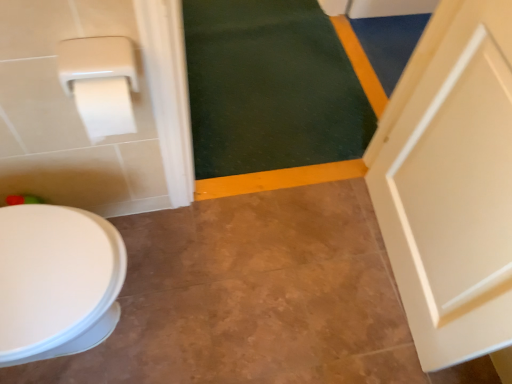
I want to click on white matte toilet paper at upper left, so click(100, 82).

What do you see at coordinates (100, 82) in the screenshot? The width and height of the screenshot is (512, 384). I see `white matte toilet paper at upper left` at bounding box center [100, 82].

Locate an element on the screen. dark green carpet at upper center is located at coordinates (270, 87).

Describe the element at coordinates (270, 87) in the screenshot. This screenshot has width=512, height=384. I see `dark green carpet at upper center` at that location.

This screenshot has width=512, height=384. In order to click on white matte toilet paper at upper left in this screenshot , I will do `click(100, 82)`.

Is white matte toilet paper at upper left at the left side of dark green carpet at upper center?

Yes.

Is the position of white matte toilet paper at upper left more distant than that of dark green carpet at upper center?

No, it is not.

Is point (110, 47) closer or farther from the camera than point (215, 140)?

Point (110, 47) is positioned closer to the camera compared to point (215, 140).

Based on the photo, from the image's perspective, is white matte toilet paper at upper left below dark green carpet at upper center?

Yes, from the image's perspective, white matte toilet paper at upper left is beneath dark green carpet at upper center.

From a real-world perspective, which object stands above the other?

white matte toilet paper at upper left is physically above.

Considering the sizes of white matte toilet paper at upper left and dark green carpet at upper center in the image, is white matte toilet paper at upper left wider or thinner than dark green carpet at upper center?

In the image, white matte toilet paper at upper left appears to be more narrow than dark green carpet at upper center.

Between white matte toilet paper at upper left and dark green carpet at upper center, which one has less height?

dark green carpet at upper center is shorter.

Does white matte toilet paper at upper left have a larger size compared to dark green carpet at upper center?

No.

Is white matte toilet paper at upper left completely or partially outside of dark green carpet at upper center?

That's correct, white matte toilet paper at upper left is outside of dark green carpet at upper center.

Is the surface of white matte toilet paper at upper left in direct contact with dark green carpet at upper center?

No, white matte toilet paper at upper left is not next to dark green carpet at upper center.

Is white matte toilet paper at upper left facing away from dark green carpet at upper center?

white matte toilet paper at upper left is not turned away from dark green carpet at upper center.

Measure the distance between white matte toilet paper at upper left and dark green carpet at upper center.

The distance of white matte toilet paper at upper left from dark green carpet at upper center is 1.01 meters.

The image size is (512, 384). Find the location of `bath mat on the right of the white matte toilet paper at upper left`. bath mat on the right of the white matte toilet paper at upper left is located at coordinates coord(270,87).

Is dark green carpet at upper center to the left or to the right of white matte toilet paper at upper left in the image?

dark green carpet at upper center is positioned on white matte toilet paper at upper left's right side.

Considering the positions of objects dark green carpet at upper center and white matte toilet paper at upper left in the image provided, who is in front, dark green carpet at upper center or white matte toilet paper at upper left?

white matte toilet paper at upper left is more forward.

Does point (255, 38) appear closer or farther from the camera than point (115, 101)?

Point (255, 38).

From the image's perspective, who appears lower, dark green carpet at upper center or white matte toilet paper at upper left?

From the image's view, white matte toilet paper at upper left is below.

From a real-world perspective, who is located higher, dark green carpet at upper center or white matte toilet paper at upper left?

white matte toilet paper at upper left.

Between dark green carpet at upper center and white matte toilet paper at upper left, which one has smaller width?

white matte toilet paper at upper left.

Between dark green carpet at upper center and white matte toilet paper at upper left, which one has more height?

With more height is white matte toilet paper at upper left.

Between dark green carpet at upper center and white matte toilet paper at upper left, which one has larger size?

With larger size is dark green carpet at upper center.

Is dark green carpet at upper center completely or partially outside of white matte toilet paper at upper left?

dark green carpet at upper center is positioned outside white matte toilet paper at upper left.

Is there a large distance between dark green carpet at upper center and white matte toilet paper at upper left?

Indeed, dark green carpet at upper center is not near white matte toilet paper at upper left.

Is dark green carpet at upper center facing away from white matte toilet paper at upper left?

dark green carpet at upper center does not have its back to white matte toilet paper at upper left.

The height and width of the screenshot is (384, 512). What are the coordinates of `toilet paper above the dark green carpet at upper center (from a real-world perspective)` in the screenshot? It's located at (100, 82).

Find the location of a particular element. bath mat located above the white matte toilet paper at upper left (from the image's perspective) is located at coordinates (270, 87).

Where is `toilet paper to the left of dark green carpet at upper center`? This screenshot has height=384, width=512. toilet paper to the left of dark green carpet at upper center is located at coordinates (100, 82).